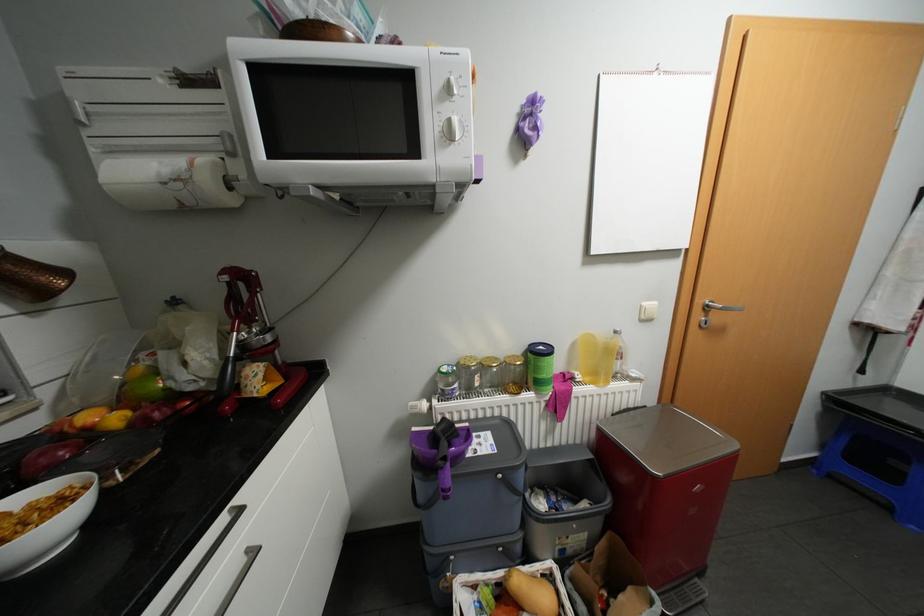
Which object does [45,524] point to?

This point indicates the white ceramic bowl.